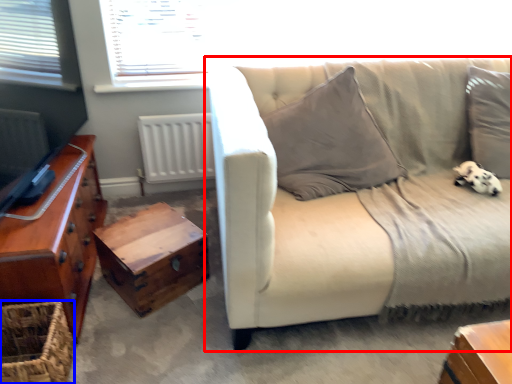
Question: Which object is further to the camera taking this photo, studio couch (highlighted by a red box) or basket (highlighted by a blue box)?

Choices:
 (A) studio couch
 (B) basket

Answer: (B)